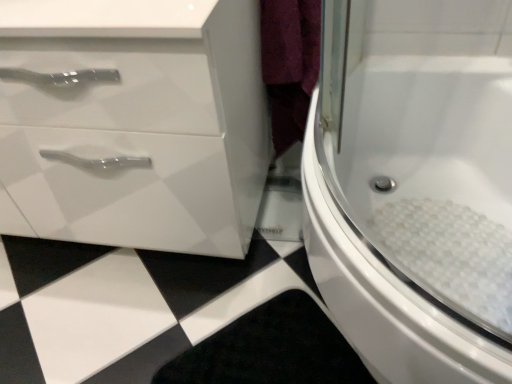
What do you see at coordinates (134, 124) in the screenshot?
I see `white glossy cabinet at left` at bounding box center [134, 124].

This screenshot has height=384, width=512. Identify the location of white glossy cabinet at left. (134, 124).

I want to click on white glossy bathtub at center right, so click(x=411, y=206).

Describe the element at coordinates (411, 206) in the screenshot. I see `white glossy bathtub at center right` at that location.

Locate an element on the screen. white glossy cabinet at left is located at coordinates (134, 124).

Is white glossy cabinet at left at the left side of white glossy bathtub at center right?

Correct, you'll find white glossy cabinet at left to the left of white glossy bathtub at center right.

Is the position of white glossy cabinet at left less distant than that of white glossy bathtub at center right?

No, it is not.

Does point (245, 150) appear closer or farther from the camera than point (383, 337)?

Point (245, 150) is positioned farther from the camera compared to point (383, 337).

From the image's perspective, between white glossy cabinet at left and white glossy bathtub at center right, who is located below?

white glossy bathtub at center right is shown below in the image.

From a real-world perspective, relative to white glossy bathtub at center right, is white glossy cabinet at left vertically above or below?

white glossy cabinet at left is situated higher than white glossy bathtub at center right in the real world.

Which of these two, white glossy cabinet at left or white glossy bathtub at center right, is wider?

Wider between the two is white glossy bathtub at center right.

Considering the relative sizes of white glossy cabinet at left and white glossy bathtub at center right in the image provided, is white glossy cabinet at left shorter than white glossy bathtub at center right?

Incorrect, the height of white glossy cabinet at left does not fall short of that of white glossy bathtub at center right.

Does white glossy cabinet at left have a larger size compared to white glossy bathtub at center right?

Yes, white glossy cabinet at left is bigger than white glossy bathtub at center right.

Is white glossy cabinet at left surrounding white glossy bathtub at center right?

No, white glossy bathtub at center right is located outside of white glossy cabinet at left.

Is white glossy cabinet at left next to white glossy bathtub at center right?

No, white glossy cabinet at left is not next to white glossy bathtub at center right.

Is white glossy cabinet at left oriented away from white glossy bathtub at center right?

That's not correct — white glossy cabinet at left is not looking away from white glossy bathtub at center right.

How different are the orientations of white glossy cabinet at left and white glossy bathtub at center right in degrees?

white glossy cabinet at left and white glossy bathtub at center right are facing 90.7 degrees away from each other.

Image resolution: width=512 pixels, height=384 pixels. I want to click on bath on the right of the white glossy cabinet at left, so click(x=411, y=206).

Considering the positions of objects white glossy bathtub at center right and white glossy cabinet at left in the image provided, who is more to the left, white glossy bathtub at center right or white glossy cabinet at left?

Positioned to the left is white glossy cabinet at left.

From the picture: Which object is further away from the camera, white glossy bathtub at center right or white glossy cabinet at left?

Positioned behind is white glossy cabinet at left.

Is point (333, 186) behind point (231, 16)?

That is True.

From the image's perspective, between white glossy bathtub at center right and white glossy cabinet at left, which one is located above?

From the image's view, white glossy cabinet at left is above.

Consider the image. From a real-world perspective, which is physically above, white glossy bathtub at center right or white glossy cabinet at left?

From a 3D spatial view, white glossy cabinet at left is above.

In the scene shown: Considering the sizes of objects white glossy bathtub at center right and white glossy cabinet at left in the image provided, who is wider, white glossy bathtub at center right or white glossy cabinet at left?

white glossy bathtub at center right is wider.

Who is taller, white glossy bathtub at center right or white glossy cabinet at left?

white glossy cabinet at left.

In the scene shown: Is white glossy bathtub at center right smaller than white glossy cabinet at left?

Correct, white glossy bathtub at center right occupies less space than white glossy cabinet at left.

Can white glossy cabinet at left be found inside white glossy bathtub at center right?

No, white glossy cabinet at left is located outside of white glossy bathtub at center right.

From the picture: Are white glossy bathtub at center right and white glossy cabinet at left located far from each other?

No.

Is white glossy bathtub at center right oriented towards white glossy cabinet at left?

Yes, white glossy bathtub at center right faces towards white glossy cabinet at left.

How much distance is there between white glossy bathtub at center right and white glossy cabinet at left?

white glossy bathtub at center right is 16.98 inches from white glossy cabinet at left.

The image size is (512, 384). What are the coordinates of `bath lying in front of the white glossy cabinet at left` in the screenshot? It's located at (411, 206).

Find the location of a particular element. bathroom cabinet above the white glossy bathtub at center right (from a real-world perspective) is located at coordinates (134, 124).

You are a GUI agent. You are given a task and a screenshot of the screen. Output one action in this format:
    pyautogui.click(x=<x>, y=<y>)
    Task: Click on the bathroom cabinet behind the white glossy bathtub at center right
    
    Given the screenshot: What is the action you would take?
    pyautogui.click(x=134, y=124)